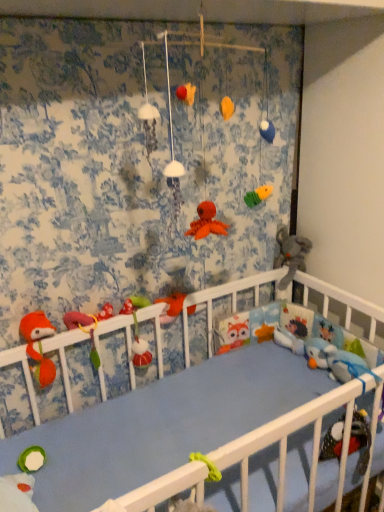
Question: Is point (31, 327) closer or farther from the camera than point (296, 254)?

Choices:
 (A) closer
 (B) farther

Answer: (A)

Question: Visually, is fluffy orange fox at left, placed as the 1th toy when sorted from left to right, positioned to the left or to the right of gray plush elephant at right, positioned as the 6th toy in left-to-right order?

Choices:
 (A) right
 (B) left

Answer: (B)

Question: Which object is positioned closest to the blue plush toy at right, the 2th toy positioned from the right?

Choices:
 (A) fluffy orange fox at left, placed as the 1th toy when sorted from left to right
 (B) matte green plush toy at center, marked as the second toy in a left-to-right arrangement
 (C) matte orange plush at center, which is counted as the fourth toy, starting from the left
 (D) fuzzy fabric toy at center, which is the 3th toy in left-to-right order
 (E) gray plush elephant at right, positioned as the 6th toy in left-to-right order

Answer: (E)

Question: Estimate the real-world distances between objects in this image. Which object is closer to the matte orange plush at center, which is counted as the fourth toy, starting from the left?

Choices:
 (A) fuzzy fabric toy at center, which is the 3th toy in left-to-right order
 (B) blue plush toy at right, the 2th toy positioned from the right
 (C) matte green plush toy at center, marked as the second toy in a left-to-right arrangement
 (D) gray plush elephant at right, positioned as the 6th toy in left-to-right order
 (E) fluffy orange fox at left, which ranks as the 6th toy in right-to-left order

Answer: (A)